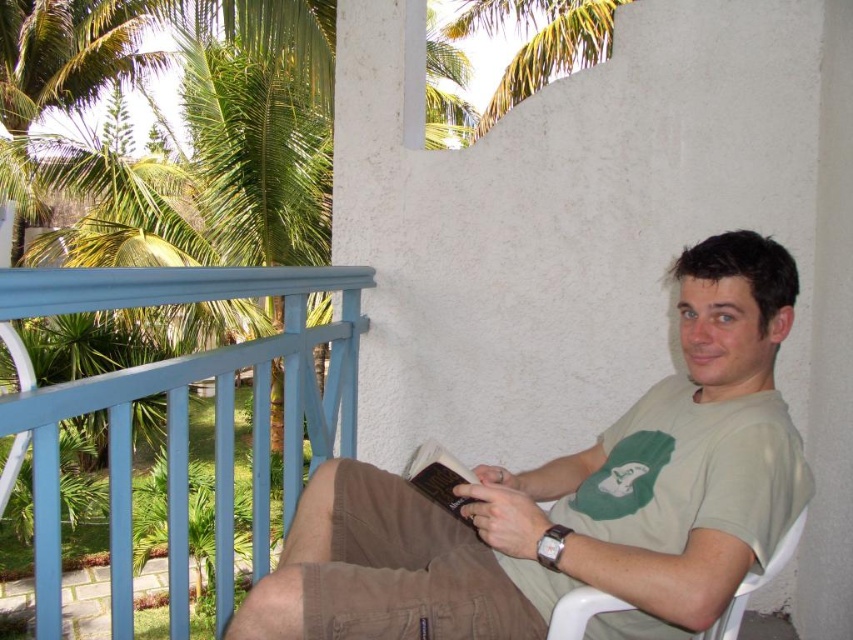
Question: Which point is closer to the camera?

Choices:
 (A) white plastic chair at right
 (B) blue painted wood railing at left

Answer: (B)

Question: In this image, where is green cotton t-shirt at center located relative to white plastic chair at right?

Choices:
 (A) above
 (B) below

Answer: (A)

Question: Can you confirm if blue painted wood railing at left is positioned above hardcover book at center?

Choices:
 (A) yes
 (B) no

Answer: (A)

Question: Observing the image, what is the correct spatial positioning of green cotton t-shirt at center in reference to blue painted wood railing at left?

Choices:
 (A) right
 (B) left

Answer: (A)

Question: Which of these objects is positioned closest to the green cotton t-shirt at center?

Choices:
 (A) white plastic chair at right
 (B) blue painted wood railing at left

Answer: (A)

Question: Which object appears closest to the camera in this image?

Choices:
 (A) green cotton t-shirt at center
 (B) hardcover book at center

Answer: (A)